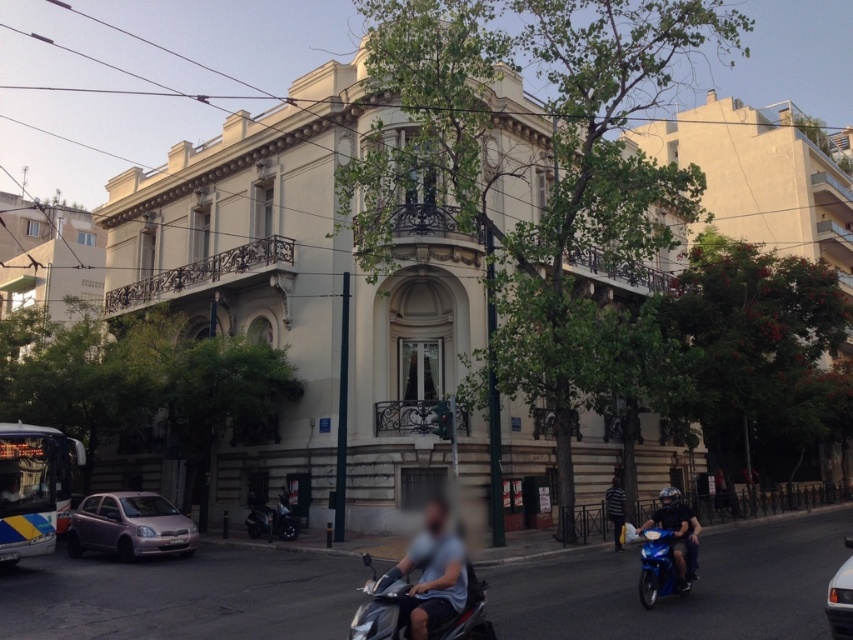
Question: Which object is positioned farthest from the silver metallic scooter at center?

Choices:
 (A) blue metallic scooter at lower right
 (B) white glossy car at lower right

Answer: (B)

Question: Estimate the real-world distances between objects in this image. Which object is closer to the purple metallic car at lower left?

Choices:
 (A) white glossy car at lower right
 (B) striped shirt at center

Answer: (B)

Question: Is white glossy car at lower right bigger than blue metallic scooter at lower right?

Choices:
 (A) yes
 (B) no

Answer: (B)

Question: Does gray fabric shirt at lower center have a smaller size compared to white glossy car at lower right?

Choices:
 (A) yes
 (B) no

Answer: (A)

Question: Which point appears closest to the camera in this image?

Choices:
 (A) (187, 541)
 (B) (469, 580)

Answer: (B)

Question: Is the position of purple metallic car at lower left more distant than that of silver metallic scooter at center?

Choices:
 (A) yes
 (B) no

Answer: (A)